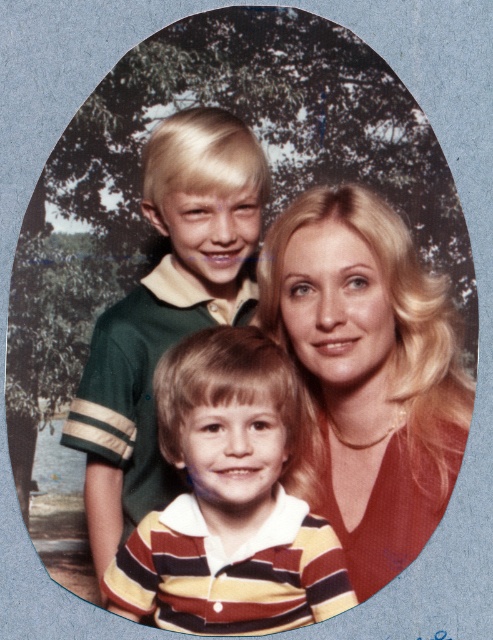
You are taking a photo of the matte green polo shirt at upper left and the blonde hair at center. Which object is positioned more to the left side of the frame?

The matte green polo shirt at upper left is positioned more to the left side of the frame than the blonde hair at center.

Based on the photo, you are a photographer setting up a tripod between the matte green polo shirt at upper left and the green jersey at center. Based on their positions, which object should you place the tripod closer to to ensure it doesn not block the view of both?

The matte green polo shirt at upper left might be wider than green jersey at center, so placing the tripod closer to the matte green polo shirt at upper left would help avoid blocking both objects.

You are a photographer setting up a photo shoot in an outdoor area with a lake in the background. You have two green shirts to place on mannequins for the shoot. The first is a matte green polo shirt at upper left and the second is a green jersey at center. According to the scene description, which shirt should you choose if you want the one that is larger in size to be placed at the upper left position?

The matte green polo shirt at upper left is larger in size than the green jersey at center, so you should choose the matte green polo shirt at upper left to be placed at the upper left position as it is already the larger one in that location.